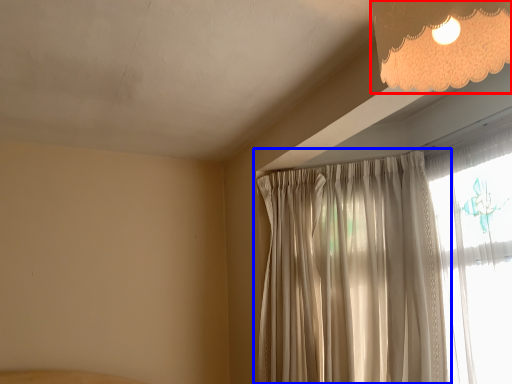
Question: Which object appears closest to the camera in this image, lamp (highlighted by a red box) or curtain (highlighted by a blue box)?

Choices:
 (A) lamp
 (B) curtain

Answer: (A)